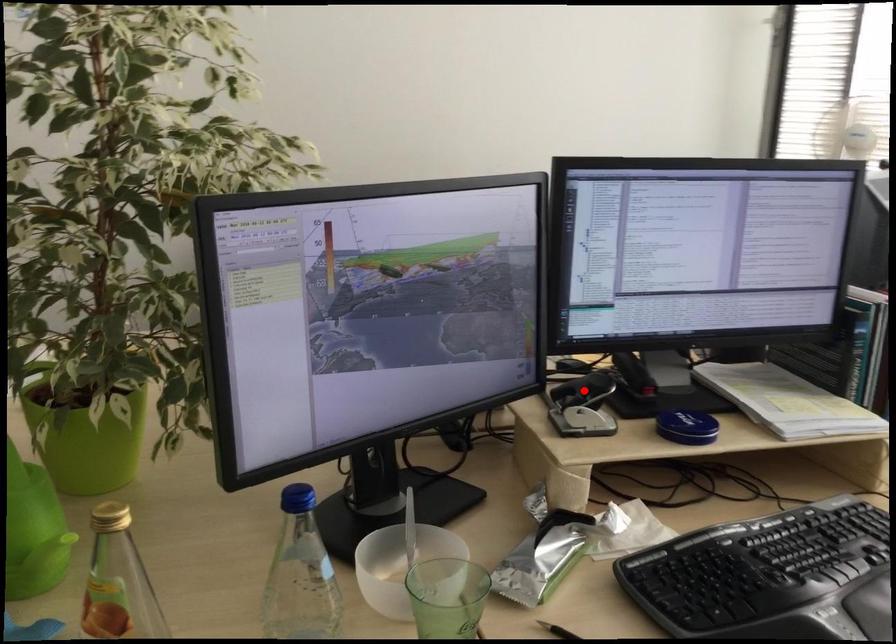
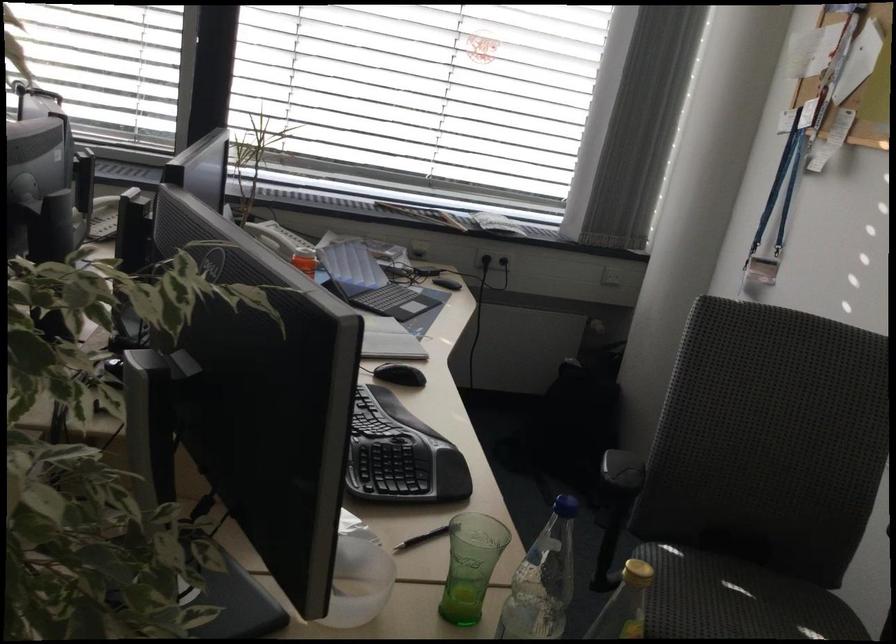
Question: I am providing you with two images of the same scene from different viewpoints. A red point is marked on the first image. At the location where the point appears in image 1, is it still visible in image 2?

Choices:
 (A) Yes
 (B) No

Answer: (B)